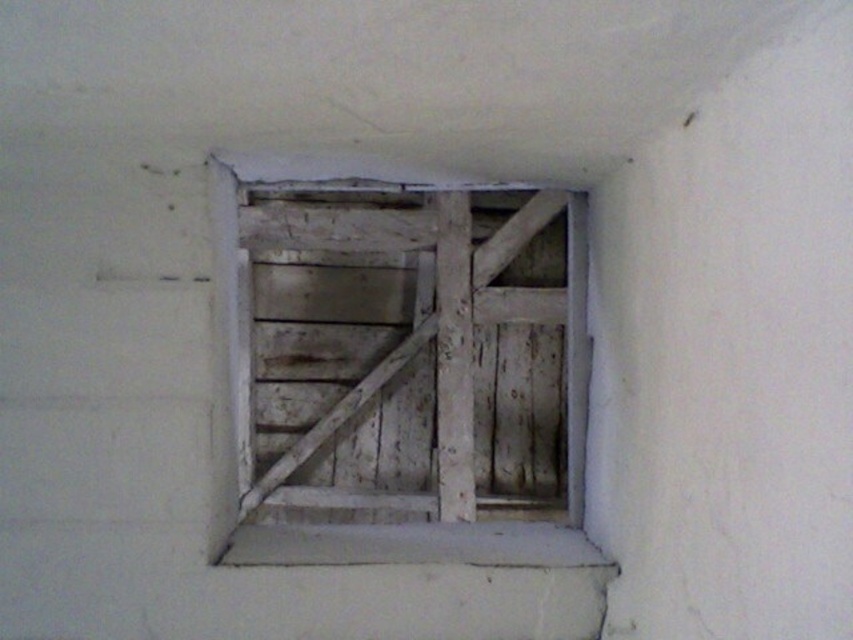
Can you confirm if weathered wood door at center is shorter than white wood window sill at center?

No, weathered wood door at center is not shorter than white wood window sill at center.

Can you confirm if weathered wood door at center is positioned to the right of white wood window sill at center?

Indeed, weathered wood door at center is positioned on the right side of white wood window sill at center.

Who is more forward, (x=492, y=403) or (x=297, y=545)?

Point (x=297, y=545) is in front.

In order to click on weathered wood door at center in this screenshot , I will do `click(517, 408)`.

Which is more to the right, weathered wood window frame at center or weathered wood door at center?

From the viewer's perspective, weathered wood door at center appears more on the right side.

Does weathered wood window frame at center have a larger size compared to weathered wood door at center?

Correct, weathered wood window frame at center is larger in size than weathered wood door at center.

Image resolution: width=853 pixels, height=640 pixels. Identify the location of weathered wood window frame at center. (402, 364).

Between weathered wood window frame at center and white wood window sill at center, which one appears on the left side from the viewer's perspective?

weathered wood window frame at center is more to the left.

Is weathered wood window frame at center to the left of white wood window sill at center from the viewer's perspective?

Correct, you'll find weathered wood window frame at center to the left of white wood window sill at center.

Find the location of a particular element. weathered wood window frame at center is located at coordinates (402, 364).